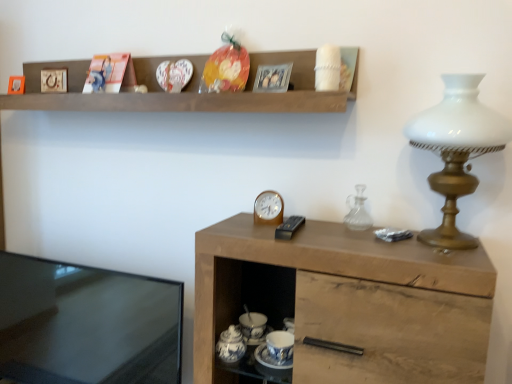
The image size is (512, 384). Find the location of `matte wooden picture frame at upper left, arranged as the third picture frame when viewed from the right`. matte wooden picture frame at upper left, arranged as the third picture frame when viewed from the right is located at coordinates (16, 85).

Image resolution: width=512 pixels, height=384 pixels. Describe the element at coordinates (187, 90) in the screenshot. I see `wooden shelf at upper center` at that location.

Locate an element on the screen. wooden shelf at upper center is located at coordinates (187, 90).

Image resolution: width=512 pixels, height=384 pixels. What do you see at coordinates (348, 301) in the screenshot?
I see `wooden cabinet at right` at bounding box center [348, 301].

Where is `white glass lamp at right`? The width and height of the screenshot is (512, 384). white glass lamp at right is located at coordinates (456, 149).

This screenshot has width=512, height=384. What do you see at coordinates (54, 80) in the screenshot?
I see `wooden picture frame at upper left, the second picture frame when ordered from front to back` at bounding box center [54, 80].

I want to click on matte wooden picture frame at upper left, acting as the first picture frame starting from the back, so click(16, 85).

Looking at this image, is metallic silver picture frame at upper center, the first picture frame positioned from the front, far away from matte wooden picture frame at upper left, arranged as the third picture frame when viewed from the right?

No, there isn't a large distance between metallic silver picture frame at upper center, the first picture frame positioned from the front, and matte wooden picture frame at upper left, arranged as the third picture frame when viewed from the right.

From a real-world perspective, which is physically above, metallic silver picture frame at upper center, which is counted as the 3th picture frame, starting from the back, or matte wooden picture frame at upper left, acting as the first picture frame starting from the back?

metallic silver picture frame at upper center, which is counted as the 3th picture frame, starting from the back, from a real-world perspective.

Relative to matte wooden picture frame at upper left, acting as the first picture frame starting from the back, is metallic silver picture frame at upper center, which is the third picture frame in left-to-right order, in front or behind?

Clearly, metallic silver picture frame at upper center, which is the third picture frame in left-to-right order, is in front of matte wooden picture frame at upper left, acting as the first picture frame starting from the back.

Between metallic silver picture frame at upper center, which is counted as the 3th picture frame, starting from the back, and matte wooden picture frame at upper left, marked as the first picture frame in a left-to-right arrangement, which one appears on the right side from the viewer's perspective?

Positioned to the right is metallic silver picture frame at upper center, which is counted as the 3th picture frame, starting from the back.

Which of these two, black glossy tv at left or white glass lamp at right, is smaller?

white glass lamp at right.

In the scene shown: Is black glossy tv at left behind white glass lamp at right?

Yes, black glossy tv at left is further from the viewer.

Does black glossy tv at left have a lesser width compared to white glass lamp at right?

Correct, the width of black glossy tv at left is less than that of white glass lamp at right.

Is black glossy tv at left positioned with its back to white glass lamp at right?

No, black glossy tv at left is not facing away from white glass lamp at right.

Is metallic silver clock at center oriented away from black glossy tv at left?

metallic silver clock at center does not have its back to black glossy tv at left.

Who is shorter, metallic silver clock at center or black glossy tv at left?

metallic silver clock at center is shorter.

From a real-world perspective, relative to black glossy tv at left, is metallic silver clock at center vertically above or below?

In terms of real-world spatial position, metallic silver clock at center is above black glossy tv at left.

Considering the sizes of objects metallic silver clock at center and black glossy tv at left in the image provided, who is bigger, metallic silver clock at center or black glossy tv at left?

With larger size is black glossy tv at left.

Is black glossy tv at left inside white glass lamp at right?

Definitely not — black glossy tv at left is not inside white glass lamp at right.

Does white glass lamp at right have a lesser width compared to black glossy tv at left?

In fact, white glass lamp at right might be wider than black glossy tv at left.

You are a GUI agent. You are given a task and a screenshot of the screen. Output one action in this format:
    pyautogui.click(x=<x>, y=<y>)
    Task: Click on the desk on the left of the white glass lamp at right
    
    Given the screenshot: What is the action you would take?
    pyautogui.click(x=86, y=324)

Which of these two, white glass lamp at right or black glossy tv at left, stands shorter?

white glass lamp at right.

In the scene shown: Is metallic silver clock at center turned away from white glass lamp at right?

No, metallic silver clock at center is not facing away from white glass lamp at right.

At what (x,y) coordinates should I click in order to perform the action: click on clock below the white glass lamp at right (from a real-world perspective). Please return your answer as a coordinate pair (x, y). The height and width of the screenshot is (384, 512). Looking at the image, I should click on (268, 208).

Does metallic silver clock at center appear on the left side of white glass lamp at right?

Indeed, metallic silver clock at center is positioned on the left side of white glass lamp at right.

Considering the relative sizes of metallic silver clock at center and white glass lamp at right in the image provided, is metallic silver clock at center wider than white glass lamp at right?

Incorrect, the width of metallic silver clock at center does not surpass that of white glass lamp at right.

Between matte wooden picture frame at upper left, marked as the third picture frame in a front-to-back arrangement, and wooden picture frame at upper left, the second picture frame when ordered from front to back, which one appears on the left side from the viewer's perspective?

matte wooden picture frame at upper left, marked as the third picture frame in a front-to-back arrangement, is more to the left.

Could you tell me if matte wooden picture frame at upper left, arranged as the third picture frame when viewed from the right, is turned towards wooden picture frame at upper left, which ranks as the 2th picture frame in back-to-front order?

No.

Considering the sizes of matte wooden picture frame at upper left, marked as the first picture frame in a left-to-right arrangement, and wooden picture frame at upper left, which ranks as the 2th picture frame in back-to-front order, in the image, is matte wooden picture frame at upper left, marked as the first picture frame in a left-to-right arrangement, wider or thinner than wooden picture frame at upper left, which ranks as the 2th picture frame in back-to-front order,?

Clearly, matte wooden picture frame at upper left, marked as the first picture frame in a left-to-right arrangement, has more width compared to wooden picture frame at upper left, which ranks as the 2th picture frame in back-to-front order.

Looking at this image, is metallic silver picture frame at upper center, marked as the first picture frame in a right-to-left arrangement, positioned with its back to wooden cabinet at right?

No, metallic silver picture frame at upper center, marked as the first picture frame in a right-to-left arrangement,'s orientation is not away from wooden cabinet at right.

Image resolution: width=512 pixels, height=384 pixels. Identify the location of the 1st picture frame above when counting from the wooden cabinet at right (from the image's perspective). 272,78.

Looking at this image, would you say metallic silver picture frame at upper center, marked as the first picture frame in a right-to-left arrangement, is inside or outside wooden cabinet at right?

metallic silver picture frame at upper center, marked as the first picture frame in a right-to-left arrangement, cannot be found inside wooden cabinet at right.

Considering the sizes of objects metallic silver picture frame at upper center, which is counted as the 3th picture frame, starting from the back, and wooden cabinet at right in the image provided, who is taller, metallic silver picture frame at upper center, which is counted as the 3th picture frame, starting from the back, or wooden cabinet at right?

wooden cabinet at right.

You are a GUI agent. You are given a task and a screenshot of the screen. Output one action in this format:
    pyautogui.click(x=<x>, y=<y>)
    Task: Click on the picture frame that is under the metallic silver picture frame at upper center, the first picture frame positioned from the front (from a real-world perspective)
    The image size is (512, 384).
    Given the screenshot: What is the action you would take?
    pyautogui.click(x=16, y=85)

At what (x,y) coordinates should I click in order to perform the action: click on lamp in front of the black glossy tv at left. Please return your answer as a coordinate pair (x, y). Looking at the image, I should click on (456, 149).

In the scene shown: Based on their spatial positions, is wooden shelf at upper center or wooden cabinet at right closer to metallic silver clock at center?

The object closer to metallic silver clock at center is wooden cabinet at right.

Looking at this image, when comparing their distances from wooden picture frame at upper left, which ranks as the 2th picture frame in back-to-front order, does matte wooden picture frame at upper left, marked as the first picture frame in a left-to-right arrangement, or black glossy tv at left seem closer?

Among the two, matte wooden picture frame at upper left, marked as the first picture frame in a left-to-right arrangement, is located nearer to wooden picture frame at upper left, which ranks as the 2th picture frame in back-to-front order.

From the image, which object appears to be nearer to white glass lamp at right, black glossy tv at left or wooden cabinet at right?

The object closer to white glass lamp at right is wooden cabinet at right.

Which object lies further to the anchor point matte wooden picture frame at upper left, arranged as the third picture frame when viewed from the right, wooden shelf at upper center or metallic silver picture frame at upper center, the first picture frame positioned from the front?

metallic silver picture frame at upper center, the first picture frame positioned from the front, lies further to matte wooden picture frame at upper left, arranged as the third picture frame when viewed from the right, than the other object.

Estimate the real-world distances between objects in this image. Which object is closer to metallic silver clock at center, matte wooden picture frame at upper left, arranged as the third picture frame when viewed from the right, or black glossy tv at left?

black glossy tv at left lies closer to metallic silver clock at center than the other object.

From the picture: From the image, which object appears to be nearer to black glossy tv at left, matte wooden picture frame at upper left, marked as the third picture frame in a front-to-back arrangement, or transparent glass carafe at right?

matte wooden picture frame at upper left, marked as the third picture frame in a front-to-back arrangement, lies closer to black glossy tv at left than the other object.

When comparing their distances from white glass lamp at right, does wooden cabinet at right or transparent glass carafe at right seem closer?

wooden cabinet at right is positioned closer to the anchor white glass lamp at right.

From the picture: Which object lies further to the anchor point white glass lamp at right, transparent glass carafe at right or black glossy tv at left?

Among the two, black glossy tv at left is located further to white glass lamp at right.

This screenshot has width=512, height=384. I want to click on clock between metallic silver picture frame at upper center, which is the third picture frame in left-to-right order, and transparent glass carafe at right, in the vertical direction, so click(x=268, y=208).

What are the coordinates of `lamp between metallic silver picture frame at upper center, marked as the first picture frame in a right-to-left arrangement, and wooden cabinet at right vertically` in the screenshot? It's located at (456, 149).

Locate an element on the screen. The height and width of the screenshot is (384, 512). shelf located between matte wooden picture frame at upper left, acting as the first picture frame starting from the back, and metallic silver picture frame at upper center, which is counted as the 3th picture frame, starting from the back, in the left-right direction is located at coordinates (187, 90).

At what (x,y) coordinates should I click in order to perform the action: click on glass vase between white glass lamp at right and wooden cabinet at right from top to bottom. Please return your answer as a coordinate pair (x, y). The width and height of the screenshot is (512, 384). Looking at the image, I should click on (358, 211).